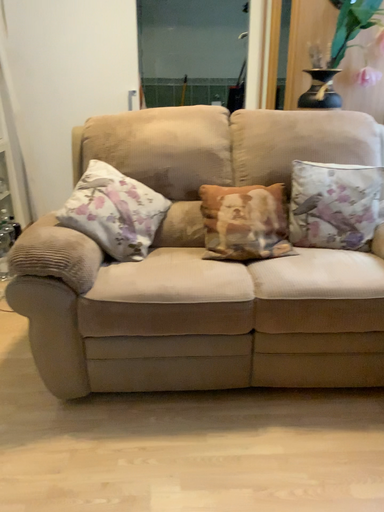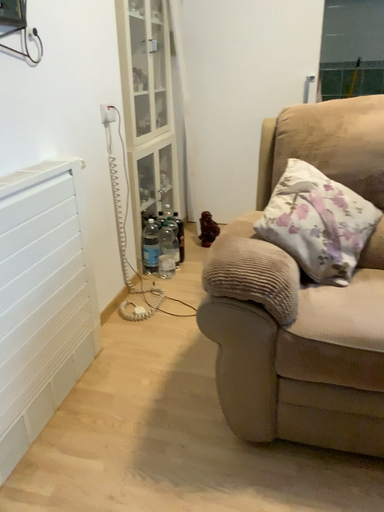
Question: How did the camera likely rotate when shooting the video?

Choices:
 (A) rotated right
 (B) rotated left

Answer: (B)